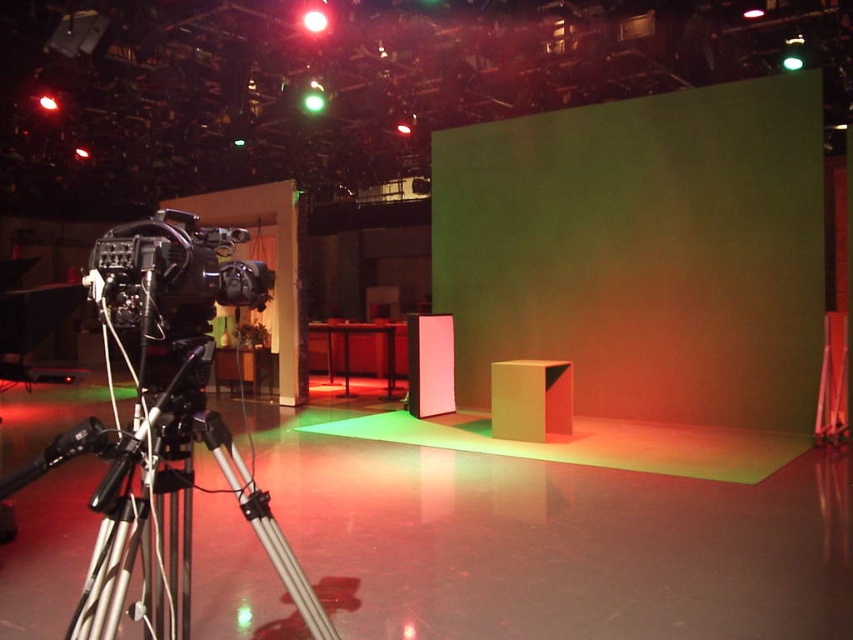
How distant is green matte projection screen at center from black matte camera at left?

green matte projection screen at center is 5.31 meters away from black matte camera at left.

Looking at this image, who is shorter, green matte projection screen at center or black matte camera at left?

black matte camera at left

Locate an element on the screen. green matte projection screen at center is located at coordinates (642, 252).

The width and height of the screenshot is (853, 640). In order to click on green matte projection screen at center in this screenshot , I will do `click(642, 252)`.

Who is more distant from viewer, (502, 129) or (119, 580)?

The point (502, 129) is behind.

This screenshot has height=640, width=853. Find the location of `green matte projection screen at center`. green matte projection screen at center is located at coordinates (642, 252).

Can you confirm if silver metallic tripod at left is smaller than black matte camera at left?

No.

Is point (114, 531) closer to camera compared to point (103, 250)?

Yes.

Identify the location of silver metallic tripod at left. (160, 513).